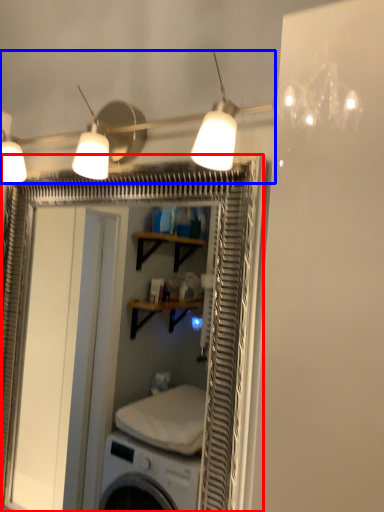
Question: Which object is further to the camera taking this photo, screen door (highlighted by a red box) or lamp (highlighted by a blue box)?

Choices:
 (A) screen door
 (B) lamp

Answer: (A)